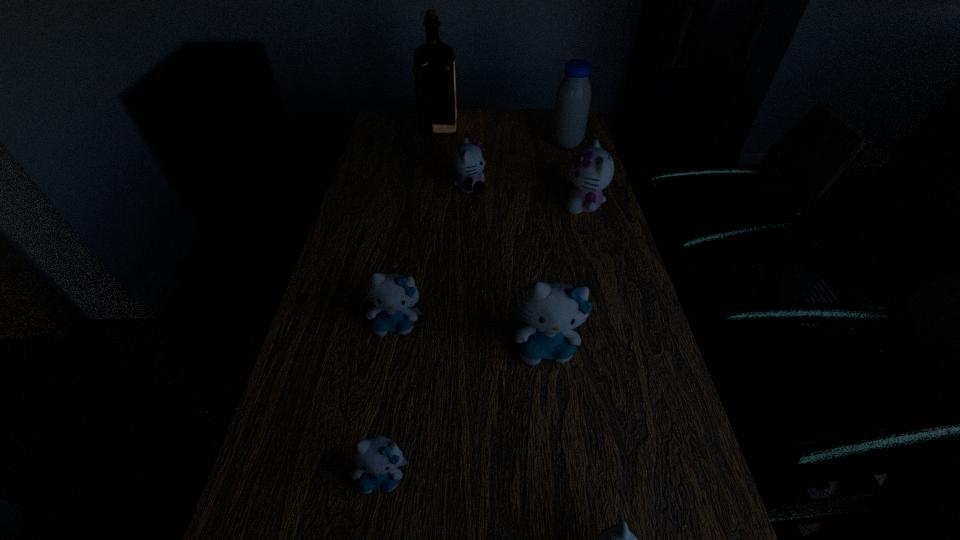
Image resolution: width=960 pixels, height=540 pixels. I want to click on vacant space that is in between the second biggest blue kitten and the seventh farthest object, so click(x=390, y=399).

Image resolution: width=960 pixels, height=540 pixels. Find the location of `free area in between the second tallest object and the biggest blue kitten`. free area in between the second tallest object and the biggest blue kitten is located at coordinates coord(556,245).

The height and width of the screenshot is (540, 960). What are the coordinates of `free space that is in between the rightmost blue kitten and the rightmost kitten` in the screenshot? It's located at (564, 276).

The image size is (960, 540). I want to click on vacant area between the biggest white kitten and the second smallest blue kitten, so click(x=491, y=264).

Identify the location of vacant region between the liquor and the second biggest blue kitten. The width and height of the screenshot is (960, 540). (418, 224).

Select which object is the fourth closest to the second biggest blue kitten. Please provide its 2D coordinates. Your answer should be formatted as a tuple, i.e. [(x, y)], where the tuple contains the x and y coordinates of a point satisfying the conditions above.

[(617, 539)]

Where is `object that is the fifth closest one to the seventh shortest object`? The width and height of the screenshot is (960, 540). object that is the fifth closest one to the seventh shortest object is located at coordinates (393, 295).

Identify which kitten is the fifth closest to the second smallest white kitten. Please provide its 2D coordinates. Your answer should be formatted as a tuple, i.e. [(x, y)], where the tuple contains the x and y coordinates of a point satisfying the conditions above.

[(617, 539)]

This screenshot has height=540, width=960. What are the coordinates of `kitten that is the closest to the smallest blue kitten` in the screenshot? It's located at (393, 295).

Point out which white kitten is positioned as the second nearest to the second biggest blue kitten. Please provide its 2D coordinates. Your answer should be formatted as a tuple, i.e. [(x, y)], where the tuple contains the x and y coordinates of a point satisfying the conditions above.

[(617, 539)]